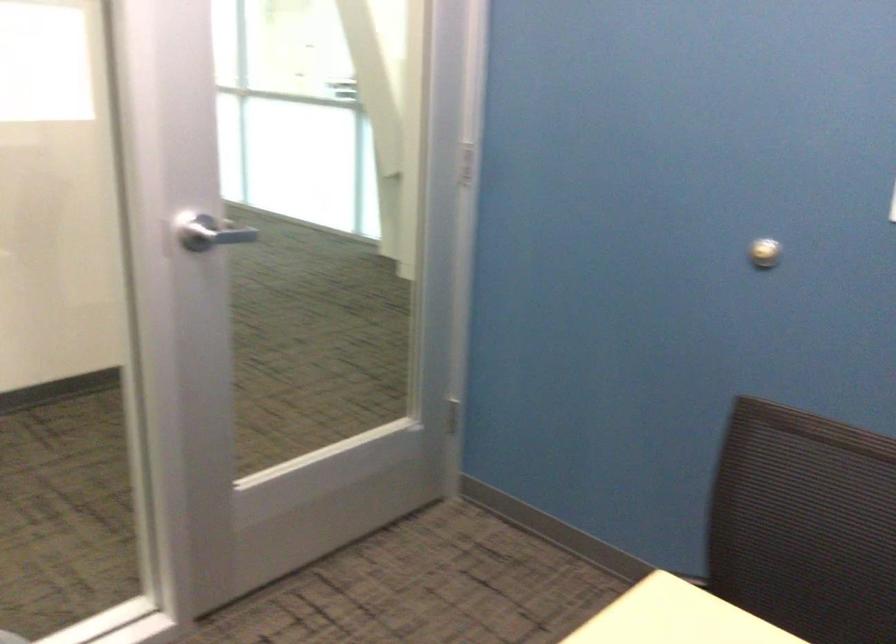
I want to click on silver door handle, so click(x=212, y=234).